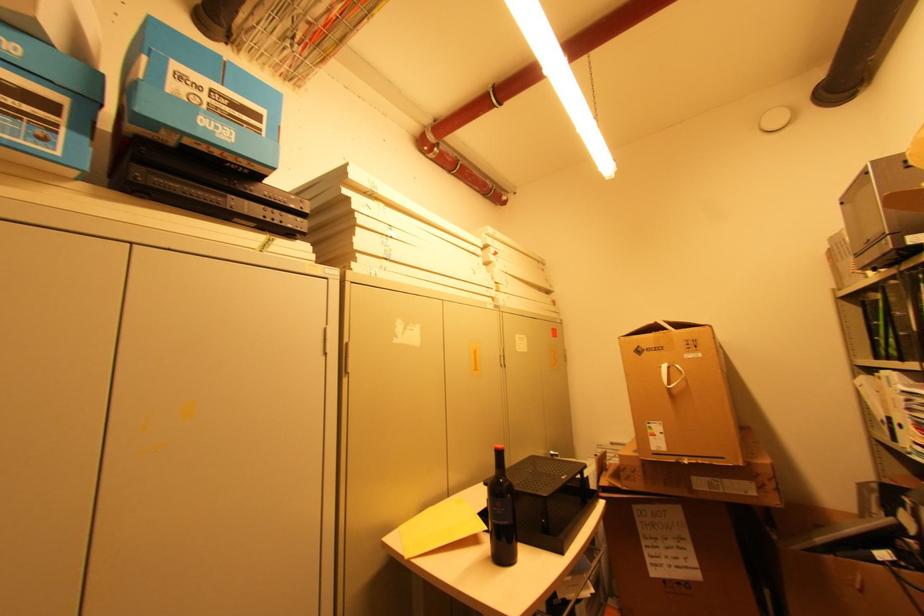
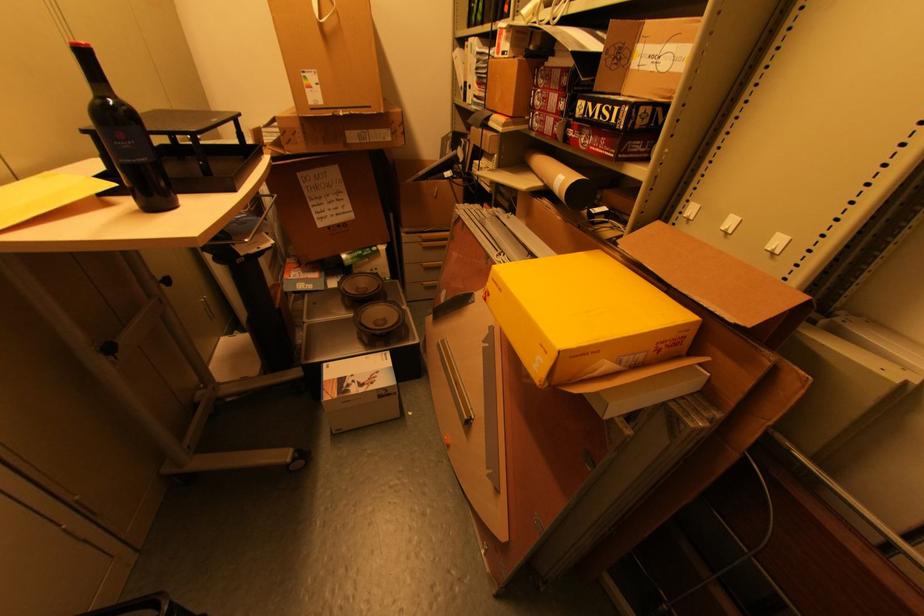
In the second image, find the point that corresponds to (x=503, y=454) in the first image.

(89, 55)